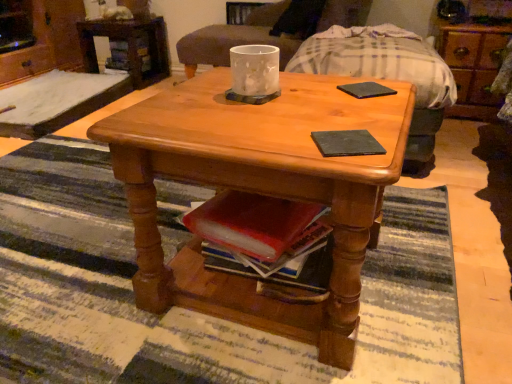
Describe the element at coordinates (473, 65) in the screenshot. I see `wooden dresser at upper right, the first dresser in the right-to-left sequence` at that location.

Measure the distance between matte glass candle at center and camera.

6.48 feet.

At what (x,y) coordinates should I click in order to perform the action: click on wooden desk at upper left. Please return your answer as a coordinate pair (x, y). The height and width of the screenshot is (384, 512). Looking at the image, I should click on coord(130,47).

In order to face wooden desk at upper left, should I rotate leftwards or rightwards?

You should look left and rotate roughly 16.841 degrees.

Describe the element at coordinates (366, 90) in the screenshot. This screenshot has width=512, height=384. I see `black matte pad at center, which is counted as the 2th pad, starting from the bottom` at that location.

Image resolution: width=512 pixels, height=384 pixels. I want to click on black matte pad at center, which is the second pad from front to back, so click(366, 90).

What do you see at coordinates (47, 42) in the screenshot?
I see `brushed metal dresser at upper left, acting as the first dresser starting from the left` at bounding box center [47, 42].

Find the location of a particular element. This screenshot has width=512, height=384. translucent glass candle at center is located at coordinates (255, 70).

This screenshot has width=512, height=384. I want to click on wooden dresser at upper right, the 2th dresser viewed from the left, so click(x=473, y=65).

This screenshot has height=384, width=512. Identify the location of the 1st pad to the right when counting from the light brown wood coffee table at center. (347, 143).

Which of these two, light brown wood coffee table at center or black matte pad at center, the 2th pad positioned from the back, is bigger?

With larger size is light brown wood coffee table at center.

From the picture: Is light brown wood coffee table at center taller than black matte pad at center, positioned as the 1th pad in left-to-right order?

Indeed, light brown wood coffee table at center has a greater height compared to black matte pad at center, positioned as the 1th pad in left-to-right order.

From the image's perspective, relative to black matte pad at center, the 2th pad positioned from the back, is light brown wood coffee table at center above or below?

light brown wood coffee table at center is below black matte pad at center, the 2th pad positioned from the back.

Is wooden dresser at upper right, the first dresser in the right-to-left sequence, not within light brown wood coffee table at center?

Yes, wooden dresser at upper right, the first dresser in the right-to-left sequence, is outside of light brown wood coffee table at center.

Is wooden dresser at upper right, the first dresser in the right-to-left sequence, to the right of light brown wood coffee table at center from the viewer's perspective?

Indeed, wooden dresser at upper right, the first dresser in the right-to-left sequence, is positioned on the right side of light brown wood coffee table at center.

This screenshot has width=512, height=384. Identify the location of the 1st dresser behind the light brown wood coffee table at center. (473, 65).

Based on the photo, from a real-world perspective, is wooden dresser at upper right, the 2th dresser viewed from the left, physically located above or below light brown wood coffee table at center?

From a real-world perspective, wooden dresser at upper right, the 2th dresser viewed from the left, is physically below light brown wood coffee table at center.

From the image's perspective, who appears lower, wooden desk at upper left or wooden armchair at center?

wooden armchair at center is shown below in the image.

Does point (145, 21) appear closer or farther from the camera than point (349, 50)?

Point (145, 21) is positioned farther from the camera compared to point (349, 50).

From a real-world perspective, who is located higher, wooden desk at upper left or wooden armchair at center?

In real-world perspective, wooden armchair at center is above.

From the image's perspective, which one is positioned lower, brushed metal dresser at upper left, which appears as the 2th dresser when viewed from the right, or wooden dresser at upper right, the first dresser in the right-to-left sequence?

wooden dresser at upper right, the first dresser in the right-to-left sequence, is shown below in the image.

Does brushed metal dresser at upper left, acting as the first dresser starting from the left, have a larger size compared to wooden dresser at upper right, the 2th dresser viewed from the left?

Yes.

This screenshot has width=512, height=384. I want to click on dresser lying behind the wooden dresser at upper right, the first dresser in the right-to-left sequence, so click(x=47, y=42).

Considering the relative sizes of brushed metal dresser at upper left, acting as the first dresser starting from the left, and wooden dresser at upper right, the 2th dresser viewed from the left, in the image provided, is brushed metal dresser at upper left, acting as the first dresser starting from the left, taller than wooden dresser at upper right, the 2th dresser viewed from the left,?

Yes.

Considering the relative sizes of light brown wood coffee table at center and matte glass candle at center in the image provided, is light brown wood coffee table at center bigger than matte glass candle at center?

Incorrect, light brown wood coffee table at center is not larger than matte glass candle at center.

Which object is more forward, light brown wood coffee table at center or matte glass candle at center?

light brown wood coffee table at center is more forward.

Is light brown wood coffee table at center positioned with its back to matte glass candle at center?

No, light brown wood coffee table at center's orientation is not away from matte glass candle at center.

From a real-world perspective, is light brown wood coffee table at center positioned over matte glass candle at center based on gravity?

Incorrect, from a real-world perspective, light brown wood coffee table at center is lower than matte glass candle at center.

Which dresser is the 1st one when counting from the back of the black matte pad at center, the 1th pad in the right-to-left sequence? Please provide its 2D coordinates.

[(473, 65)]

Considering the positions of objects black matte pad at center, the 1th pad when ordered from top to bottom, and wooden dresser at upper right, the 2th dresser viewed from the left, in the image provided, who is more to the right, black matte pad at center, the 1th pad when ordered from top to bottom, or wooden dresser at upper right, the 2th dresser viewed from the left,?

wooden dresser at upper right, the 2th dresser viewed from the left.

Does black matte pad at center, which is counted as the 2th pad, starting from the bottom, have a lesser height compared to wooden dresser at upper right, the 2th dresser viewed from the left?

Yes.

Consider the image. Which object is thinner, black matte pad at center, marked as the first pad in a back-to-front arrangement, or wooden dresser at upper right, the 2th dresser viewed from the left?

With smaller width is black matte pad at center, marked as the first pad in a back-to-front arrangement.

Is wooden desk at upper left located outside black matte pad at center, which is the second pad from front to back?

Yes.

Which is more to the right, wooden desk at upper left or black matte pad at center, the 1th pad when ordered from top to bottom?

Positioned to the right is black matte pad at center, the 1th pad when ordered from top to bottom.

Is black matte pad at center, the 1th pad when ordered from top to bottom, at the back of wooden desk at upper left?

wooden desk at upper left does not have its back to black matte pad at center, the 1th pad when ordered from top to bottom.

I want to click on coffee table below the black matte pad at center, positioned as the 1th pad in left-to-right order (from the image's perspective), so click(x=259, y=191).

Locate an element on the screen. coffee table on the left of wooden dresser at upper right, the first dresser in the right-to-left sequence is located at coordinates coord(259,191).

From the image, which object appears to be nearer to wooden armchair at center, wooden dresser at upper right, the first dresser in the right-to-left sequence, or light brown wood coffee table at center?

Among the two, wooden dresser at upper right, the first dresser in the right-to-left sequence, is located nearer to wooden armchair at center.

Looking at the image, which one is located closer to wooden dresser at upper right, the 2th dresser viewed from the left, wooden desk at upper left or light brown wood coffee table at center?

Based on the image, light brown wood coffee table at center appears to be nearer to wooden dresser at upper right, the 2th dresser viewed from the left.

Looking at the image, which one is located closer to wooden desk at upper left, translucent glass candle at center or black matte pad at center, acting as the second pad starting from the top?

Based on the image, translucent glass candle at center appears to be nearer to wooden desk at upper left.

When comparing their distances from black matte pad at center, positioned as the 1th pad in left-to-right order, does light brown wood coffee table at center or translucent glass candle at center seem further?

translucent glass candle at center is positioned further to the anchor black matte pad at center, positioned as the 1th pad in left-to-right order.

When comparing their distances from wooden desk at upper left, does matte glass candle at center or wooden armchair at center seem closer?

Based on the image, matte glass candle at center appears to be nearer to wooden desk at upper left.

Which object lies further to the anchor point wooden armchair at center, black matte pad at center, which is the second pad from left to right, or wooden dresser at upper right, the first dresser in the right-to-left sequence?

black matte pad at center, which is the second pad from left to right, is positioned further to the anchor wooden armchair at center.

Looking at the image, which one is located closer to wooden dresser at upper right, the first dresser in the right-to-left sequence, matte glass candle at center or wooden armchair at center?

wooden armchair at center lies closer to wooden dresser at upper right, the first dresser in the right-to-left sequence, than the other object.

Based on their spatial positions, is wooden dresser at upper right, the 2th dresser viewed from the left, or translucent glass candle at center further from brushed metal dresser at upper left, which appears as the 2th dresser when viewed from the right?

wooden dresser at upper right, the 2th dresser viewed from the left, is positioned further to the anchor brushed metal dresser at upper left, which appears as the 2th dresser when viewed from the right.

You are a GUI agent. You are given a task and a screenshot of the screen. Output one action in this format:
    pyautogui.click(x=<x>, y=<y>)
    Task: Click on the coffee table between brushed metal dresser at upper left, which appears as the 2th dresser when viewed from the right, and black matte pad at center, positioned as the 1th pad in left-to-right order
    Image resolution: width=512 pixels, height=384 pixels.
    Given the screenshot: What is the action you would take?
    pyautogui.click(x=259, y=191)

Where is `pad between black matte pad at center, acting as the second pad starting from the top, and wooden dresser at upper right, the first dresser in the right-to-left sequence, in the front-back direction`? The width and height of the screenshot is (512, 384). pad between black matte pad at center, acting as the second pad starting from the top, and wooden dresser at upper right, the first dresser in the right-to-left sequence, in the front-back direction is located at coordinates (366, 90).

Image resolution: width=512 pixels, height=384 pixels. Find the location of `armchair between light brown wood coffee table at center and matte glass candle at center from front to back`. armchair between light brown wood coffee table at center and matte glass candle at center from front to back is located at coordinates (342, 67).

At what (x,y) coordinates should I click in order to perform the action: click on pad between black matte pad at center, the second pad from the right, and matte glass candle at center, along the z-axis. Please return your answer as a coordinate pair (x, y). Looking at the image, I should click on (366, 90).